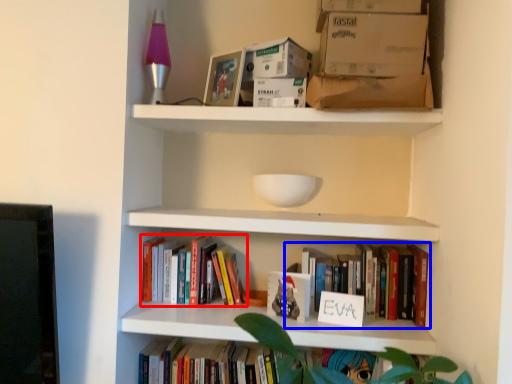
Question: Among these objects, which one is farthest to the camera, book (highlighted by a red box) or book (highlighted by a blue box)?

Choices:
 (A) book
 (B) book

Answer: (A)